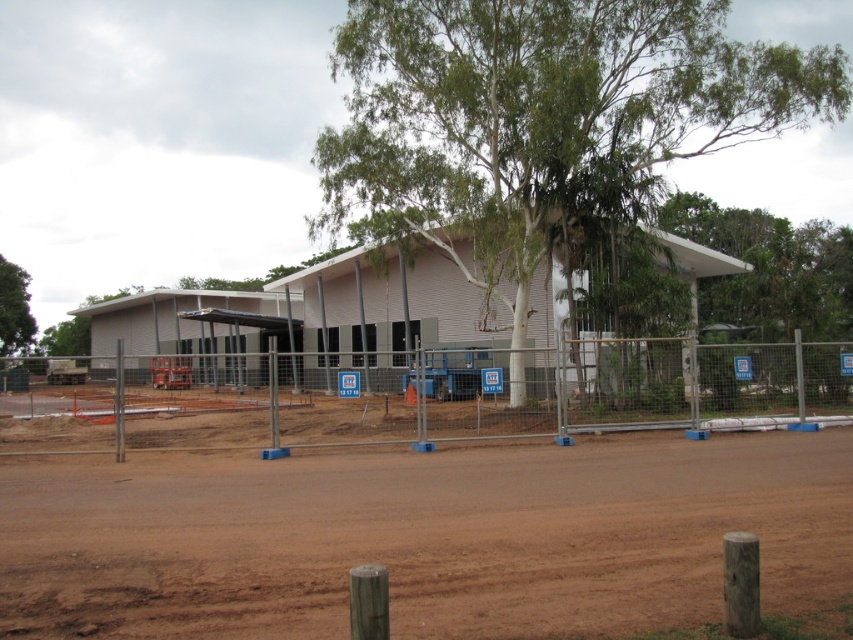
You are a delivery truck driver arriving at the construction site. You need to park your truck on the brown dirt track at lower center. However, you are concerned about the height clearance because your truck is 3 meters tall. Can you safely park there considering the green leafy tree at center?

The brown dirt track at lower center has a lesser height compared to the green leafy tree at center. Since the truck is 3 meters tall, the track may not have sufficient clearance. Check the actual height of the track before parking to ensure it accommodates the truck safely.

You are a delivery truck driver arriving at the construction site. You need to park your truck near the green leafy tree at center without crossing the metal mesh fence at center. Can you park your truck within 10 meters of the tree?

The green leafy tree at center is 10.32 meters away from the metal mesh fence at center. Since the truck must stay outside the fence, the minimum distance from the tree would be 10.32 meters, which is just beyond the 10 meter limit. Therefore, the truck cannot park within 10 meters of the tree without crossing the fence.

You are a delivery truck driver arriving at the construction site. You need to park your truck near the metal mesh fence at center without blocking the green leafy tree at left. Based on their positions, which side of the fence should you park on to avoid blocking the tree?

Since the metal mesh fence at center is to the right of the green leafy tree at left, you should park on the left side of the metal mesh fence at center to avoid blocking the tree.